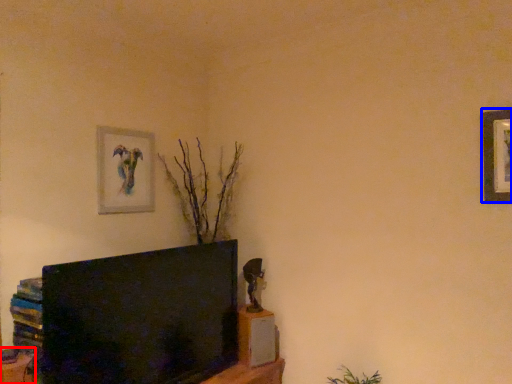
Question: Among these objects, which one is farthest to the camera, furniture (highlighted by a red box) or picture frame (highlighted by a blue box)?

Choices:
 (A) furniture
 (B) picture frame

Answer: (A)